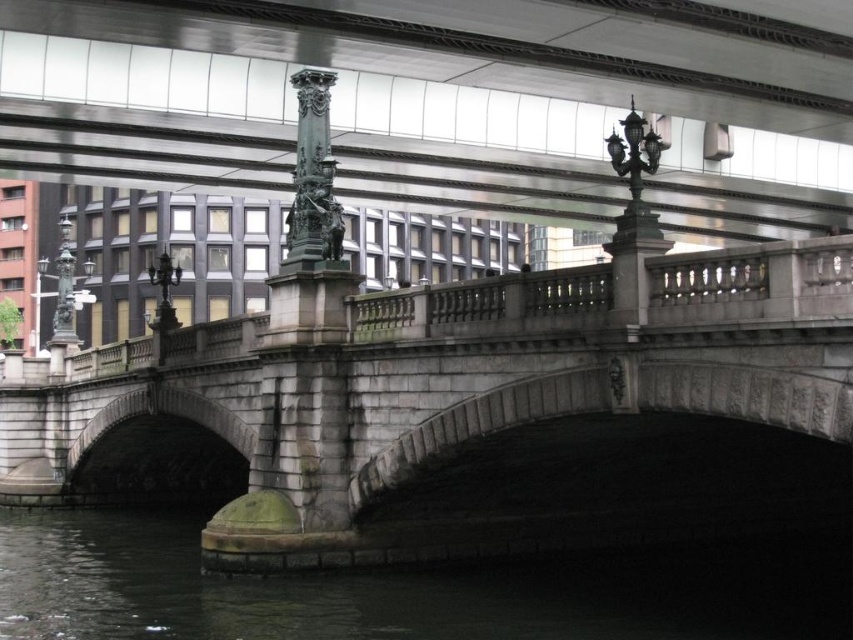
Is gray stone bridge at center further to camera compared to bronze ornate column at center?

No, it is in front of bronze ornate column at center.

At what (x,y) coordinates should I click in order to perform the action: click on gray stone bridge at center. Please return your answer as a coordinate pair (x, y). This screenshot has height=640, width=853. Looking at the image, I should click on (468, 412).

Locate an element on the screen. The height and width of the screenshot is (640, 853). gray stone bridge at center is located at coordinates (468, 412).

Does gray stone bridge at center have a larger size compared to dark stone water at lower center?

Yes, gray stone bridge at center is bigger than dark stone water at lower center.

Which is behind, point (90, 369) or point (699, 573)?

The point (90, 369) is more distant.

You are a GUI agent. You are given a task and a screenshot of the screen. Output one action in this format:
    pyautogui.click(x=<x>, y=<y>)
    Task: Click on the gray stone bridge at center
    The width and height of the screenshot is (853, 640).
    Given the screenshot: What is the action you would take?
    pyautogui.click(x=468, y=412)

Does dark stone water at lower center have a greater width compared to polished bronze statue at left?

Correct, the width of dark stone water at lower center exceeds that of polished bronze statue at left.

Is dark stone water at lower center above polished bronze statue at left?

Actually, dark stone water at lower center is below polished bronze statue at left.

Describe the element at coordinates (404, 589) in the screenshot. The image size is (853, 640). I see `dark stone water at lower center` at that location.

Find the location of `dark stone water at lower center`. dark stone water at lower center is located at coordinates (404, 589).